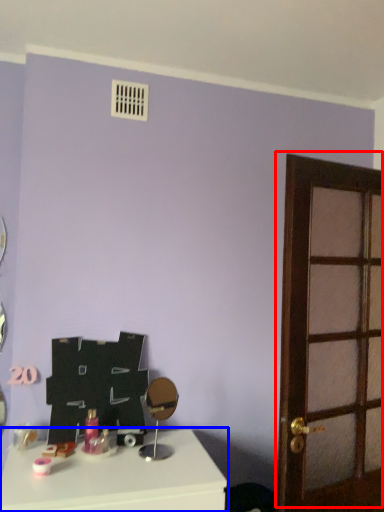
Question: Among these objects, which one is farthest to the camera, door (highlighted by a red box) or table (highlighted by a blue box)?

Choices:
 (A) door
 (B) table

Answer: (A)